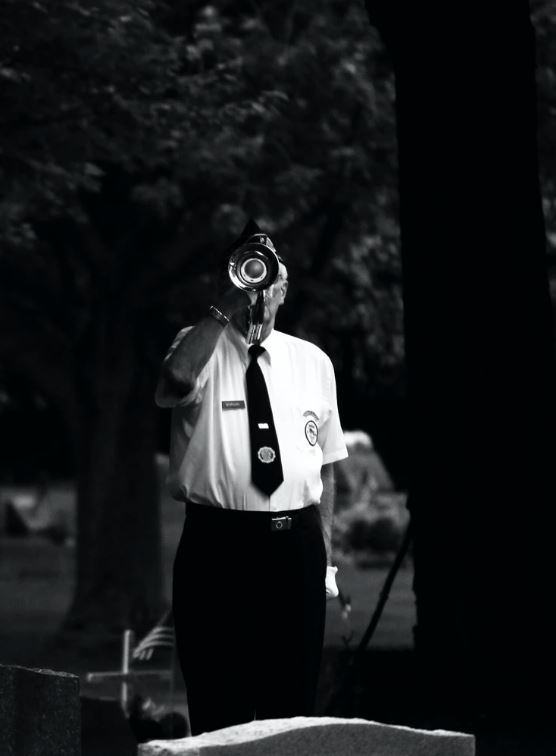
This screenshot has height=756, width=556. In order to click on light in this screenshot , I will do click(x=248, y=256).